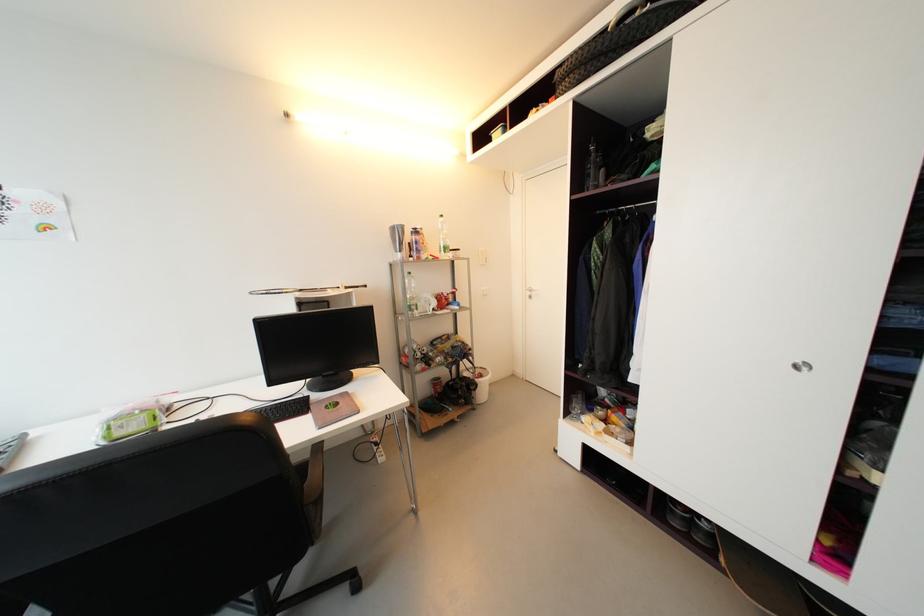
Which object does [409,293] point to?

This point indicates the clear plastic bottle.